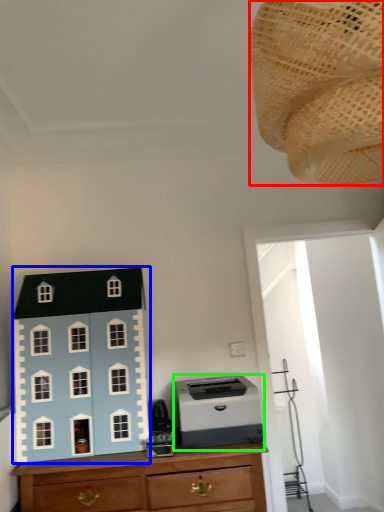
Question: Based on their relative distances, which object is farther from toy (highlighted by a red box)? Choose from toy (highlighted by a blue box) and printer (highlighted by a green box).

Choices:
 (A) toy
 (B) printer

Answer: (A)